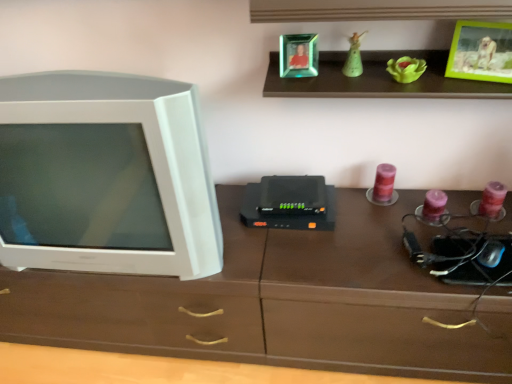
Question: Is white plastic television at left oriented towards green matte figurine at upper center?

Choices:
 (A) yes
 (B) no

Answer: (B)

Question: Considering the relative positions of white plastic television at left and green matte figurine at upper center in the image provided, is white plastic television at left to the right of green matte figurine at upper center from the viewer's perspective?

Choices:
 (A) yes
 (B) no

Answer: (B)

Question: From the image's perspective, is white plastic television at left above green matte figurine at upper center?

Choices:
 (A) yes
 (B) no

Answer: (B)

Question: Can you confirm if white plastic television at left is wider than green matte figurine at upper center?

Choices:
 (A) yes
 (B) no

Answer: (A)

Question: From a real-world perspective, is white plastic television at left physically above green matte figurine at upper center?

Choices:
 (A) yes
 (B) no

Answer: (B)

Question: Would you say green matte figurine at upper center is to the left or to the right of green plastic picture frame at upper right, which is the 1th picture frame in right-to-left order, in the picture?

Choices:
 (A) right
 (B) left

Answer: (B)

Question: Is point (352, 41) positioned closer to the camera than point (504, 31)?

Choices:
 (A) farther
 (B) closer

Answer: (A)

Question: Is green matte figurine at upper center taller or shorter than green plastic picture frame at upper right, which is the 2th picture frame from left to right?

Choices:
 (A) tall
 (B) short

Answer: (B)

Question: Is green matte figurine at upper center wider or thinner than green plastic picture frame at upper right, which is the 2th picture frame from left to right?

Choices:
 (A) thin
 (B) wide

Answer: (A)

Question: Looking at the image, does green plastic picture frame at upper right, which is the 1th picture frame in right-to-left order, seem bigger or smaller compared to emerald glass photo frame at upper center, the 1th picture frame from the left?

Choices:
 (A) small
 (B) big

Answer: (B)

Question: Which is correct: green plastic picture frame at upper right, which is the 2th picture frame from left to right, is inside emerald glass photo frame at upper center, the 1th picture frame from the left, or outside of it?

Choices:
 (A) inside
 (B) outside

Answer: (B)

Question: Is green plastic picture frame at upper right, which is the 1th picture frame in right-to-left order, taller or shorter than emerald glass photo frame at upper center, the 1th picture frame from the left?

Choices:
 (A) short
 (B) tall

Answer: (B)

Question: Considering their positions, is green plastic picture frame at upper right, which is the 2th picture frame from left to right, located in front of or behind emerald glass photo frame at upper center, the 1th picture frame from the left?

Choices:
 (A) front
 (B) behind

Answer: (A)

Question: Considering the positions of point (377, 201) and point (301, 56), is point (377, 201) closer or farther from the camera than point (301, 56)?

Choices:
 (A) farther
 (B) closer

Answer: (A)

Question: Considering the relative positions of purple wax candle at center-right and emerald glass photo frame at upper center, the 1th picture frame from the left, in the image provided, is purple wax candle at center-right to the left or to the right of emerald glass photo frame at upper center, the 1th picture frame from the left,?

Choices:
 (A) right
 (B) left

Answer: (A)